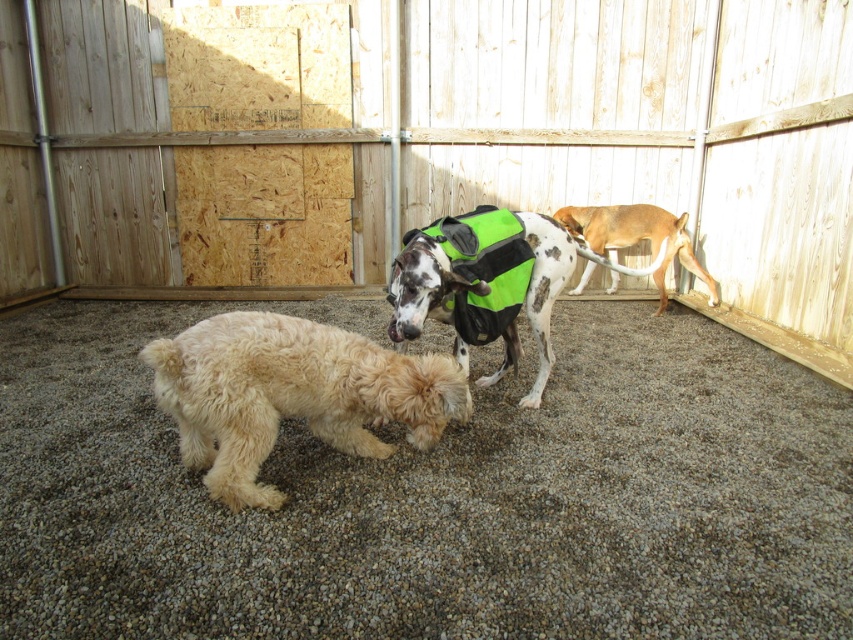
You are a dog owner who wants to ensure your two dogs can comfortably play in their enclosure. The enclosure has a gravel floor. Given that the minimum recommended distance between two dogs to prevent overcrowding is 6 feet, can the fuzzy beige dog at lower left and the brown fur dog at right maintain a safe distance?

The distance between the fuzzy beige dog at lower left and the brown fur dog at right is 8.97 feet, which exceeds the minimum recommended distance of 6 feet. Therefore, they can maintain a safe distance.

You are a dog owner who wants to ensure your brown fur dog at right has enough space to move around in the wooden enclosure. Given the wooden fence at center is part of the enclosure, can you estimate if the enclosure is spacious enough for the dog?

The wooden fence at center has a larger size compared to the brown fur dog at right, indicating that the enclosure likely provides sufficient space for the dog to move around comfortably.